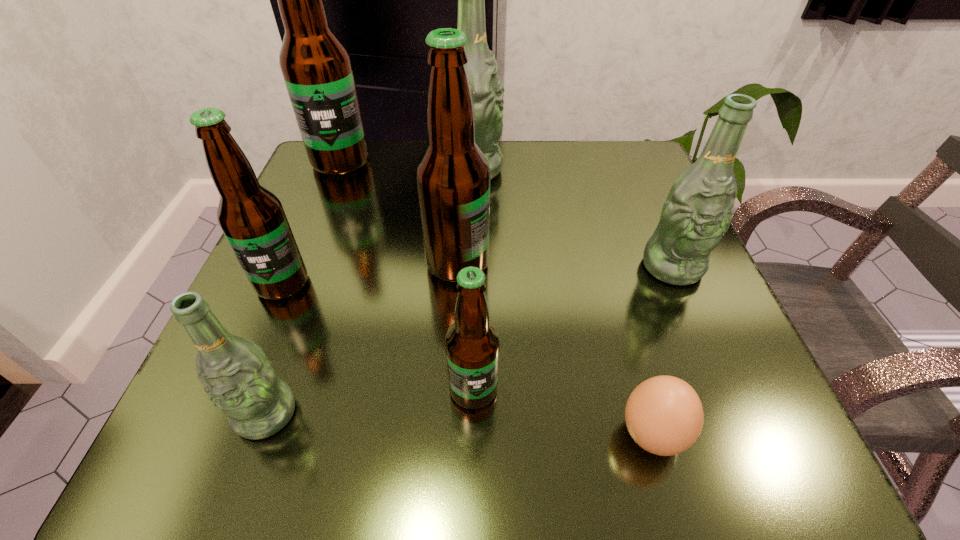
I want to click on free space that satisfies the following two spatial constraints: 1. on the label of the boiled egg; 2. on the right side of the second smallest brown beer bottle, so click(218, 435).

Image resolution: width=960 pixels, height=540 pixels. Identify the location of blank area in the image that satisfies the following two spatial constraints: 1. on the surface of the farthest green beer bottle; 2. on the label of the third biggest brown beer bottle. (470, 284).